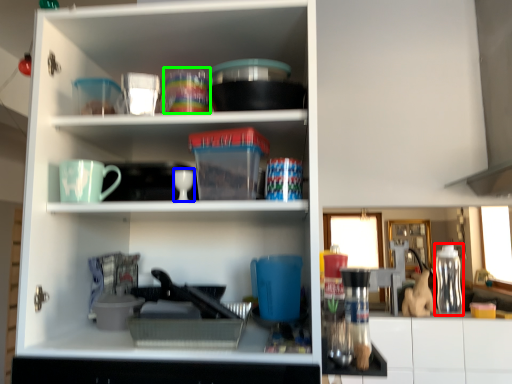
Question: Which object is the closest to the bottle (highlighted by a red box)? Choose among these: tableware (highlighted by a blue box) or tableware (highlighted by a green box).

Choices:
 (A) tableware
 (B) tableware

Answer: (A)